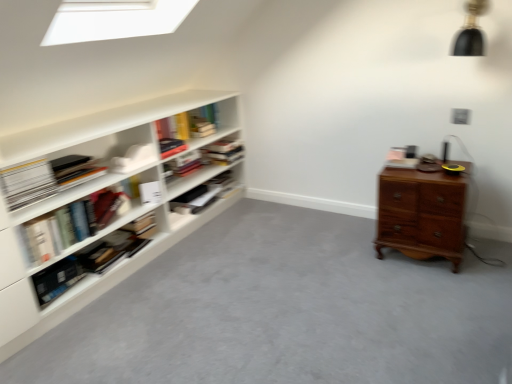
This screenshot has width=512, height=384. What are the coordinates of `vacant area on top of white matte book at left, acting as the 2th paperback book starting from the right (from a real-world perspective)` in the screenshot? It's located at (16, 150).